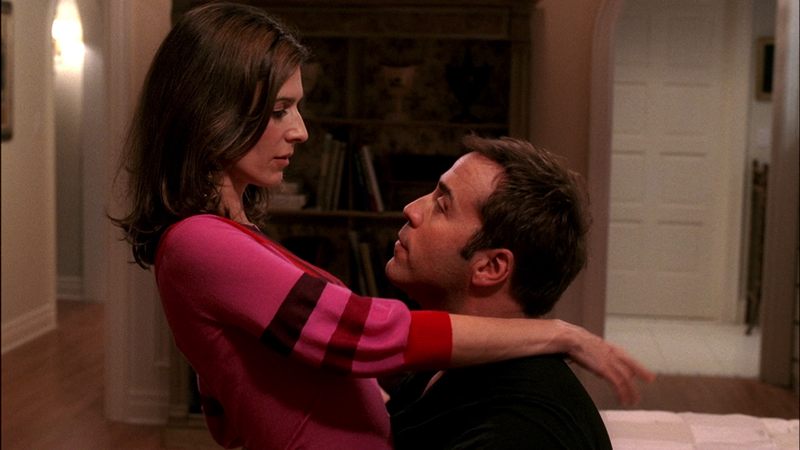
This screenshot has width=800, height=450. In order to click on white floor in this screenshot , I will do `click(681, 338)`.